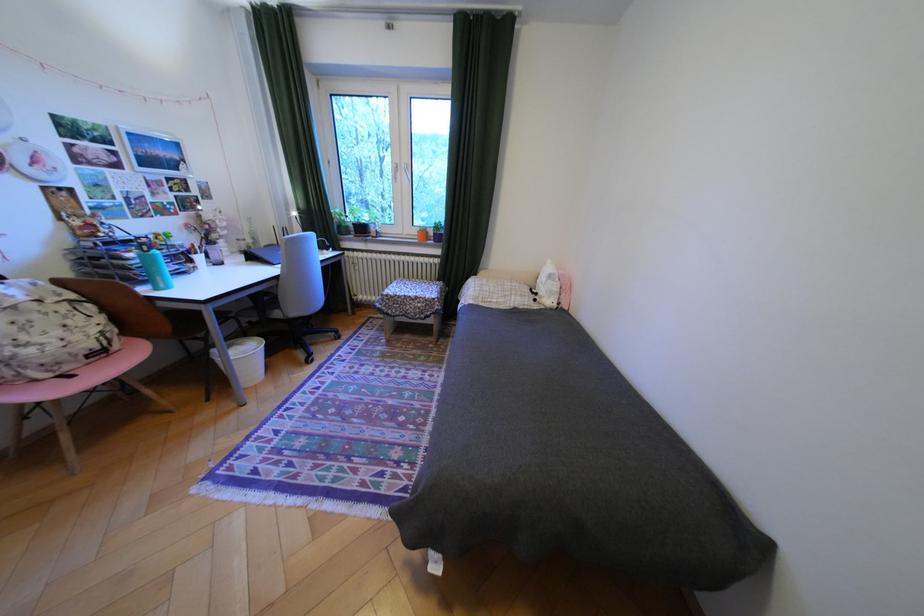
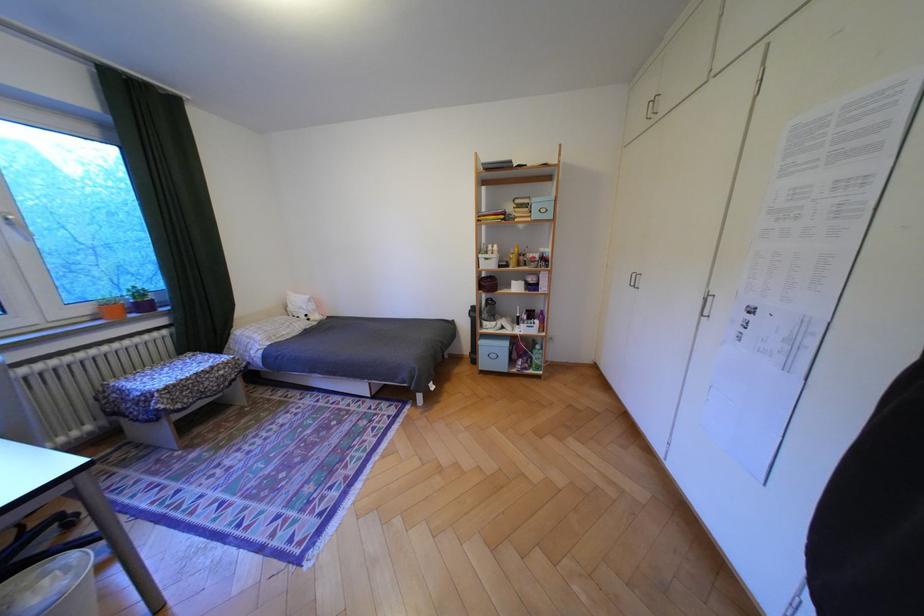
Find the pixel in the second image that matches [417,174] in the first image.

(18, 227)